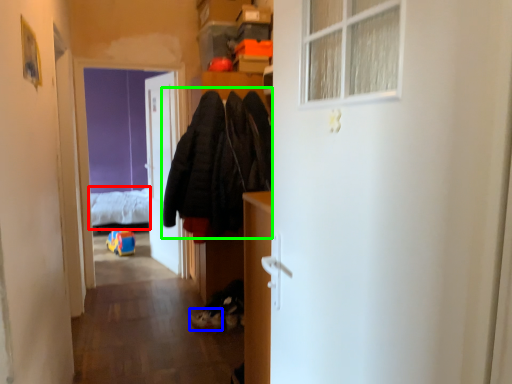
Question: Estimate the real-world distances between objects in this image. Which object is closer to bed (highlighted by a red box), shoe (highlighted by a blue box) or clothing (highlighted by a green box)?

Choices:
 (A) shoe
 (B) clothing

Answer: (B)